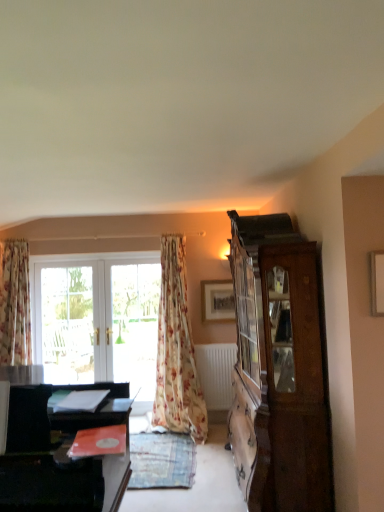
Locate an element on the screen. The image size is (384, 512). vacant region above white matte radiator at lower center (from a real-world perspective) is located at coordinates (214, 343).